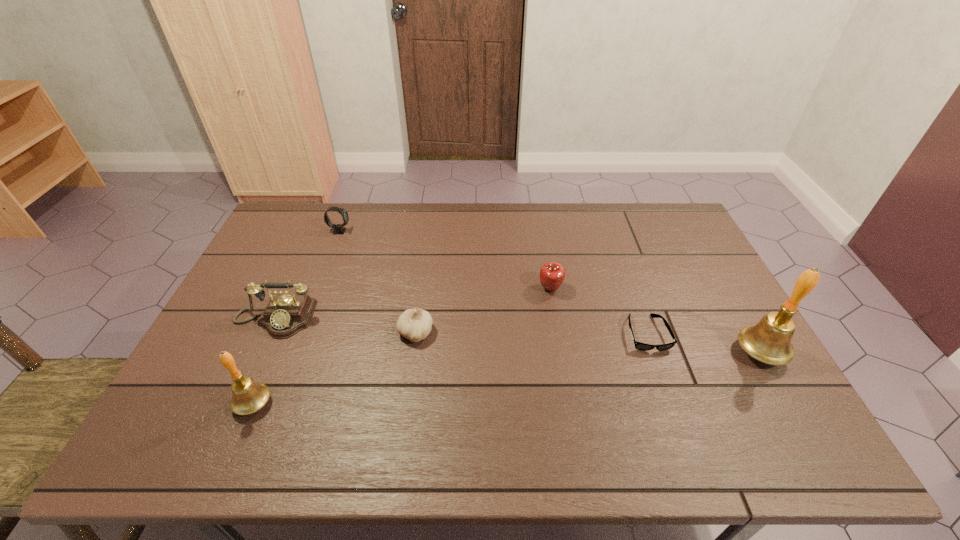
Find the location of `telephone`. telephone is located at coordinates (286, 314).

The image size is (960, 540). In order to click on vacant space located 0.300m on the right of the left bell in this screenshot , I will do `click(396, 404)`.

Find the location of a particular element. This screenshot has width=960, height=540. free space located on the back of the right bell is located at coordinates (708, 262).

This screenshot has width=960, height=540. What are the coordinates of `vacant space located on the face of the watch` in the screenshot? It's located at (401, 231).

I want to click on vacant space located on the front of the garlic, so click(410, 375).

Locate an element on the screen. This screenshot has height=540, width=960. free location located on the right of the apple is located at coordinates pos(608,289).

I want to click on free space located 0.190m on the dial of the fifth shortest object, so point(238,401).

Image resolution: width=960 pixels, height=540 pixels. I want to click on object at the far edge, so click(338, 229).

Where is `object positioned at the near edge`? The height and width of the screenshot is (540, 960). object positioned at the near edge is located at coordinates (249, 396).

Where is `bell situated at the left edge`? The image size is (960, 540). bell situated at the left edge is located at coordinates (249, 396).